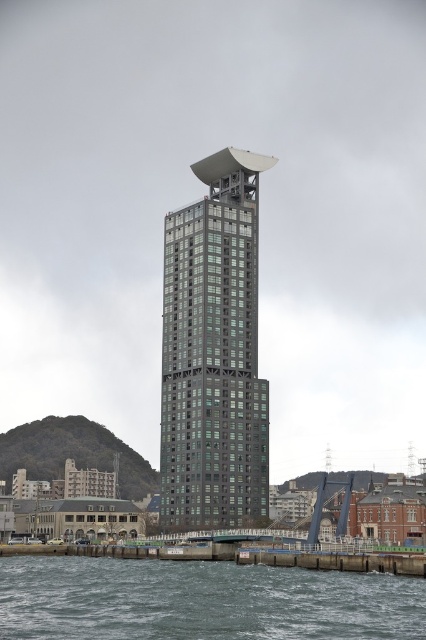
Is point (3, 557) closer to camera compared to point (340, 556)?

No, it is behind (340, 556).

Between point (43, 564) and point (389, 564), which one is positioned behind?

The point (43, 564) is more distant.

Where is `transparent water at lower center`? The height and width of the screenshot is (640, 426). transparent water at lower center is located at coordinates (201, 602).

Who is shorter, metallic glass bell tower at center or smooth concrete dock at lower center?

Standing shorter between the two is smooth concrete dock at lower center.

Does metallic glass bell tower at center appear under smooth concrete dock at lower center?

No, metallic glass bell tower at center is not below smooth concrete dock at lower center.

This screenshot has width=426, height=640. What do you see at coordinates (213, 353) in the screenshot?
I see `metallic glass bell tower at center` at bounding box center [213, 353].

At what (x,y) coordinates should I click in order to perform the action: click on metallic glass bell tower at center. Please return your answer as a coordinate pair (x, y). Image resolution: width=426 pixels, height=640 pixels. Looking at the image, I should click on (213, 353).

Can you confirm if metallic glass bell tower at center is taller than transparent water at lower center?

Yes.

Is metallic glass bell tower at center to the left of transparent water at lower center from the viewer's perspective?

No, metallic glass bell tower at center is not to the left of transparent water at lower center.

Identify the location of metallic glass bell tower at center. The image size is (426, 640). (213, 353).